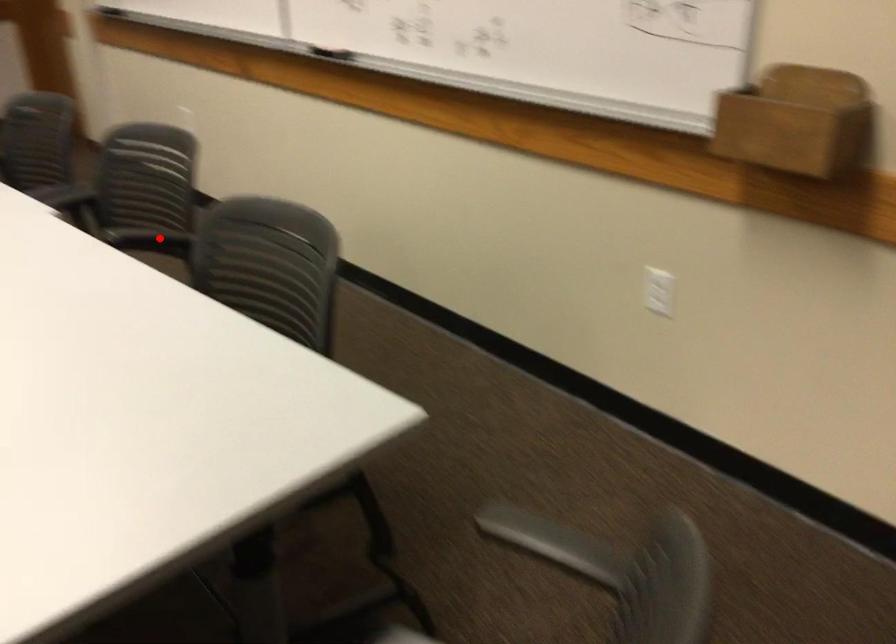
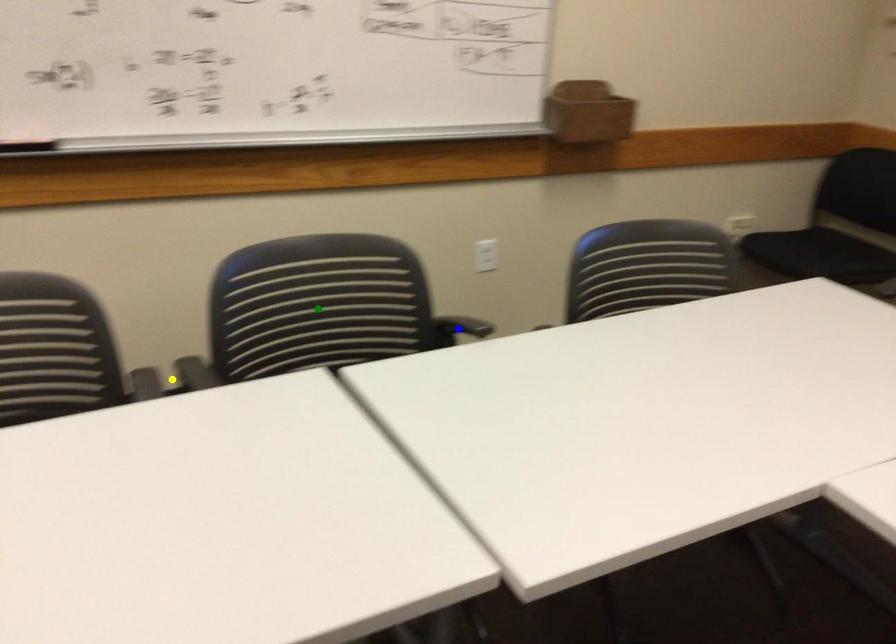
Question: I am providing you with two images of the same scene from different viewpoints. A red point is marked on the first image. You are given multiple points on the second image. Can you choose the point in image 2 that corresponds to the point in image 1?

Choices:
 (A) blue point
 (B) yellow point
 (C) green point

Answer: (A)